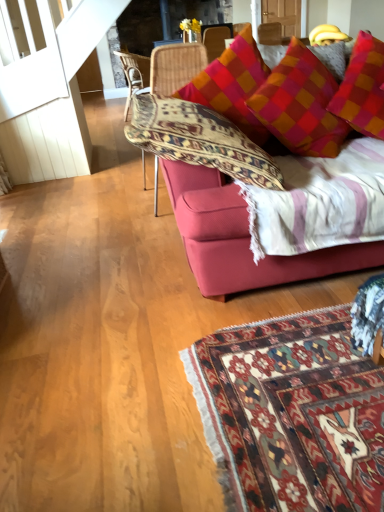
Question: Is woven rattan chair at center, the first chair when ordered from back to front, thinner than woven wicker chair at center, which appears as the 2th chair when viewed from the back?

Choices:
 (A) yes
 (B) no

Answer: (B)

Question: Can we say woven rattan chair at center, the 2th chair ordered from the bottom, lies outside woven wicker chair at center, which appears as the 2th chair when viewed from the top?

Choices:
 (A) no
 (B) yes

Answer: (B)

Question: Is woven rattan chair at center, marked as the 1th chair in a left-to-right arrangement, shorter than woven wicker chair at center, the first chair positioned from the front?

Choices:
 (A) no
 (B) yes

Answer: (B)

Question: Does woven rattan chair at center, marked as the 1th chair in a left-to-right arrangement, turn towards woven wicker chair at center, which appears as the 2th chair when viewed from the back?

Choices:
 (A) no
 (B) yes

Answer: (A)

Question: Is woven rattan chair at center, marked as the 1th chair in a left-to-right arrangement, surrounding woven wicker chair at center, which is counted as the 2th chair, starting from the left?

Choices:
 (A) yes
 (B) no

Answer: (B)

Question: From a real-world perspective, is woven wicker chair at center, which appears as the 2th chair when viewed from the top, physically located above or below woven rattan chair at center, the 2th chair ordered from the bottom?

Choices:
 (A) above
 (B) below

Answer: (A)

Question: Is woven wicker chair at center, which appears as the 2th chair when viewed from the back, inside the boundaries of woven rattan chair at center, the 2th chair ordered from the bottom, or outside?

Choices:
 (A) outside
 (B) inside

Answer: (A)

Question: In the image, is woven wicker chair at center, the first chair positioned from the front, on the left side or the right side of woven rattan chair at center, marked as the 1th chair in a left-to-right arrangement?

Choices:
 (A) right
 (B) left

Answer: (A)

Question: Is woven wicker chair at center, which is counted as the 2th chair, starting from the left, taller or shorter than woven rattan chair at center, marked as the 1th chair in a left-to-right arrangement?

Choices:
 (A) tall
 (B) short

Answer: (A)

Question: Is point (129, 73) closer or farther from the camera than point (193, 60)?

Choices:
 (A) closer
 (B) farther

Answer: (B)

Question: Considering the positions of woven rattan chair at center, the 2th chair in the right-to-left sequence, and woven wicker chair at center, which is counted as the 1th chair, starting from the right, in the image, is woven rattan chair at center, the 2th chair in the right-to-left sequence, taller or shorter than woven wicker chair at center, which is counted as the 1th chair, starting from the right,?

Choices:
 (A) short
 (B) tall

Answer: (A)

Question: From a real-world perspective, is woven rattan chair at center, the 2th chair ordered from the bottom, positioned above or below woven wicker chair at center, which appears as the 2th chair when viewed from the back?

Choices:
 (A) above
 (B) below

Answer: (B)

Question: Choose the correct answer: Is woven rattan chair at center, acting as the 1th chair starting from the top, inside woven wicker chair at center, the first chair in the bottom-to-top sequence, or outside it?

Choices:
 (A) outside
 (B) inside

Answer: (A)

Question: From the image's perspective, is velvet red couch at upper right positioned above or below woven wicker chair at center, the first chair positioned from the front?

Choices:
 (A) below
 (B) above

Answer: (A)

Question: Is velvet red couch at upper right inside the boundaries of woven wicker chair at center, which appears as the 2th chair when viewed from the top, or outside?

Choices:
 (A) outside
 (B) inside

Answer: (A)